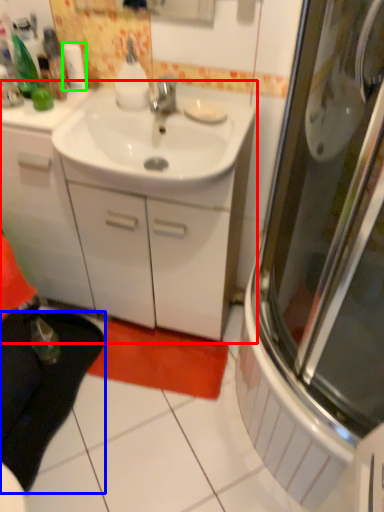
Question: Which is nearer to the bathroom cabinet (highlighted by a red box)? carpets (highlighted by a blue box) or toilet paper (highlighted by a green box).

Choices:
 (A) carpets
 (B) toilet paper

Answer: (A)